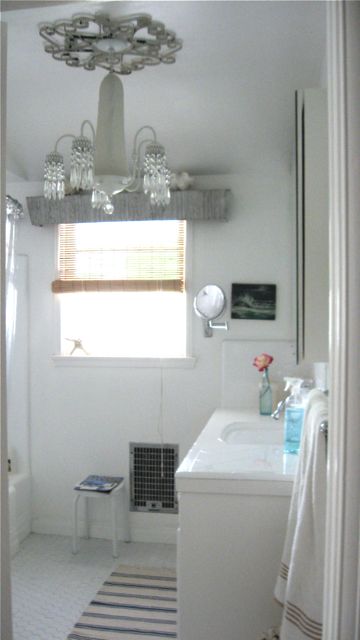
The width and height of the screenshot is (360, 640). Find the location of `empty drink bottle with flower`. empty drink bottle with flower is located at coordinates (265, 388).